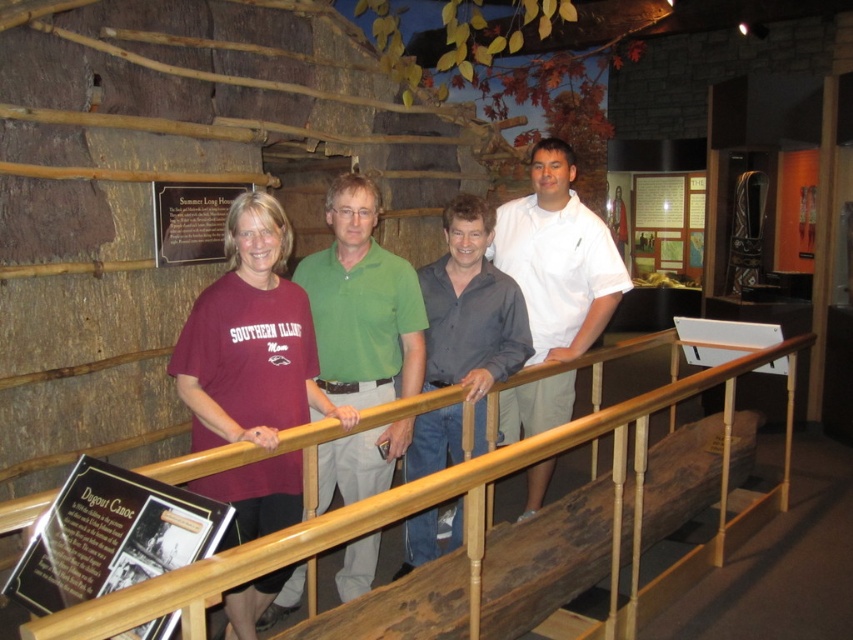
Question: Which object is farther from the camera taking this photo?

Choices:
 (A) brown polished wood rail at center
 (B) green cotton shirt at center

Answer: (B)

Question: Does brown polished wood rail at center appear on the left side of dark gray shirt at center?

Choices:
 (A) no
 (B) yes

Answer: (A)

Question: Is green cotton shirt at center below matte black plaque at upper center?

Choices:
 (A) no
 (B) yes

Answer: (B)

Question: From the image, what is the correct spatial relationship of brown polished wood rail at center in relation to matte black plaque at upper center?

Choices:
 (A) left
 (B) right

Answer: (B)

Question: Among these points, which one is farthest from the camera?

Choices:
 (A) (158, 209)
 (B) (241, 593)

Answer: (A)

Question: Among these objects, which one is nearest to the camera?

Choices:
 (A) brown polished wood rail at center
 (B) black plastic sign at lower left
 (C) white cotton polo shirt at center
 (D) green cotton shirt at center

Answer: (A)